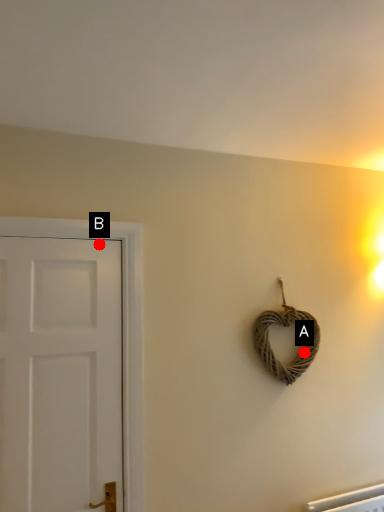
Question: Two points are circled on the image, labeled by A and B beside each circle. Which point is farther from the camera taking this photo?

Choices:
 (A) A is further
 (B) B is further

Answer: (A)